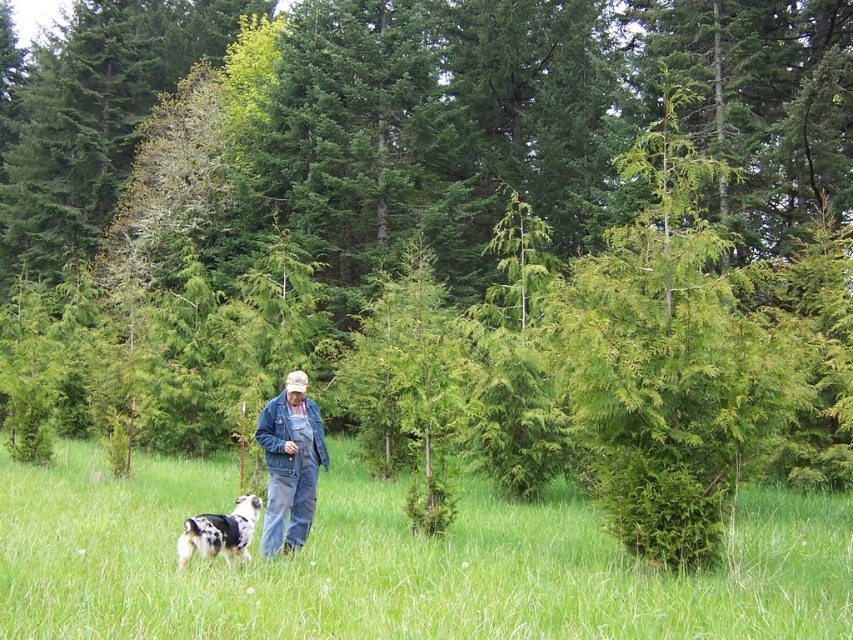
In the scene shown: You are a photographer setting up a wide shot of the scene. The denim overalls at center and the spotted fur dog at lower left are both in the frame. Based on their sizes, which one would appear larger in the photo?

The denim overalls at center would appear larger in the photo because the person wearing them is likely closer to the camera than the spotted fur dog at lower left, making them appear bigger despite the dog possibly being wider in reality. However, according to the description, the denim overalls at center might be wider than the spotted fur dog at lower left, so they would naturally appear larger in the frame.

From the picture: You are a photographer trying to capture a landscape shot of the scene. You want to focus on the point at coordinates point [474,525] and point [224,536]. Which point should you focus on first if you want to ensure both points are in focus?

You should focus on point [224,536] first because it is closer to the camera than point [474,525]. By focusing on the closer point, the farther point will also be within the depth of field.